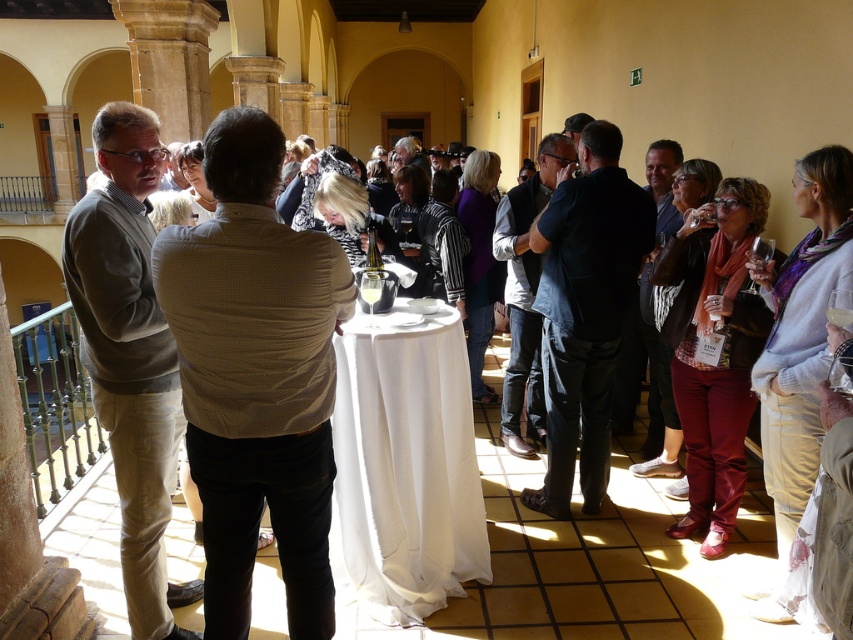
Question: Which point is closer to the camera taking this photo?

Choices:
 (A) (445, 515)
 (B) (572, 250)
 (C) (660, 202)

Answer: (A)

Question: Which point appears closest to the camera in this image?

Choices:
 (A) coord(648,406)
 (B) coord(552,157)
 (C) coord(74,289)
 (D) coord(341,355)

Answer: (C)

Question: Is light brown sweater at left below dark blue suit at center?

Choices:
 (A) yes
 (B) no

Answer: (A)

Question: Among these points, which one is nearest to the camera?

Choices:
 (A) (364, 397)
 (B) (132, 378)
 (C) (570, 145)

Answer: (B)

Question: Is white cloth-covered table at center positioned behind dark blue jeans at center?

Choices:
 (A) no
 (B) yes

Answer: (A)

Question: Is white cloth-covered table at center smaller than dark blue jeans at center?

Choices:
 (A) no
 (B) yes

Answer: (B)